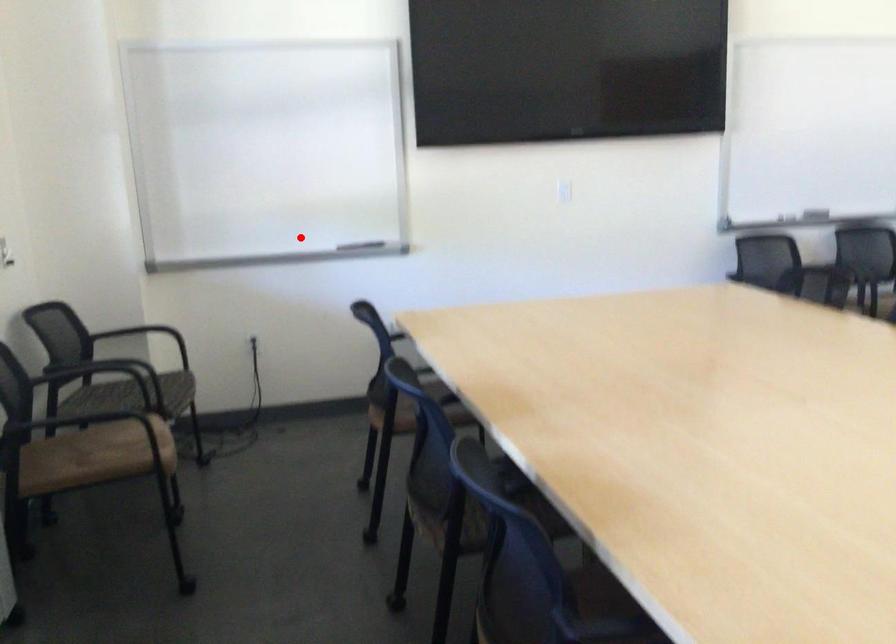
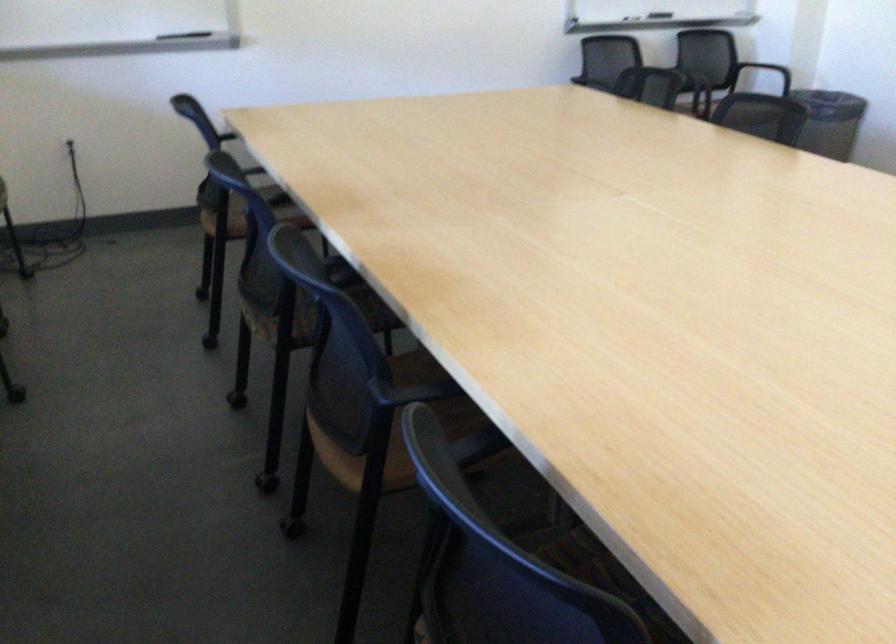
The point at the highlighted location is marked in the first image. Where is the corresponding point in the second image?

(115, 26)